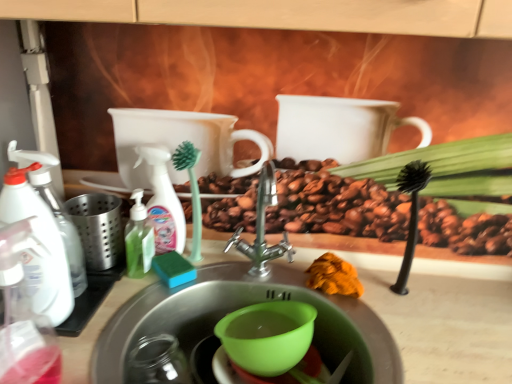
Find the location of a particular element. The width and height of the screenshot is (512, 384). vacant area that lies between green plastic scrub brush at center, the second plant from the right, and orange fabric at sink is located at coordinates (260, 276).